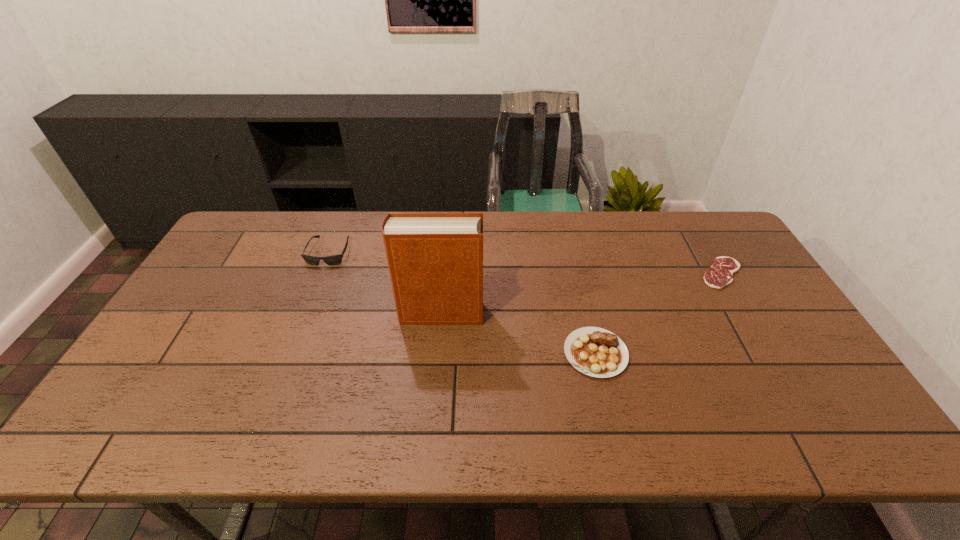
Locate an element on the screen. The height and width of the screenshot is (540, 960). hardback book is located at coordinates (435, 260).

The width and height of the screenshot is (960, 540). I want to click on the tallest object, so coord(435,260).

Locate an element on the screen. the leftmost object is located at coordinates (334, 259).

This screenshot has height=540, width=960. Find the location of `the third shortest object`. the third shortest object is located at coordinates (334, 259).

Where is `the third tallest object`? the third tallest object is located at coordinates (596, 352).

You are a GUI agent. You are given a task and a screenshot of the screen. Output one action in this format:
    pyautogui.click(x=<x>, y=<y>)
    Task: Click on the nearest object
    
    Given the screenshot: What is the action you would take?
    pyautogui.click(x=596, y=352)

At what (x,y) coordinates should I click in order to perform the action: click on the farther steak. Please return your answer as a coordinate pair (x, y). The width and height of the screenshot is (960, 540). Looking at the image, I should click on (720, 274).

Image resolution: width=960 pixels, height=540 pixels. Find the location of `the shorter steak`. the shorter steak is located at coordinates (720, 274).

This screenshot has width=960, height=540. Find the location of `vacant region located on the open cover of the third object from right to left`. vacant region located on the open cover of the third object from right to left is located at coordinates (536, 313).

You are a GUI agent. You are given a task and a screenshot of the screen. Output one action in this format:
    pyautogui.click(x=<x>, y=<y>)
    Task: Click on the free region located on the front-facing side of the leftmost object
    Image resolution: width=960 pixels, height=540 pixels.
    Given the screenshot: What is the action you would take?
    pyautogui.click(x=308, y=306)